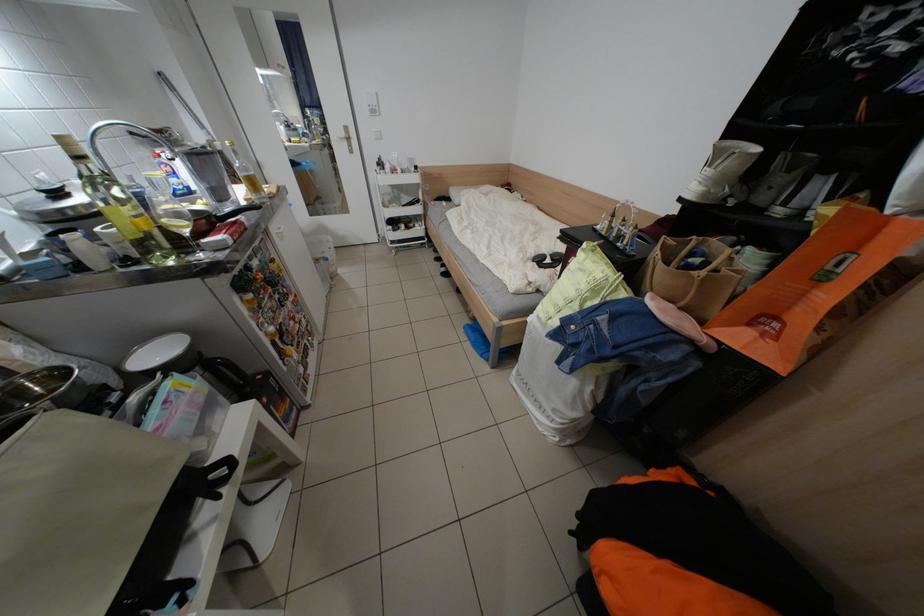
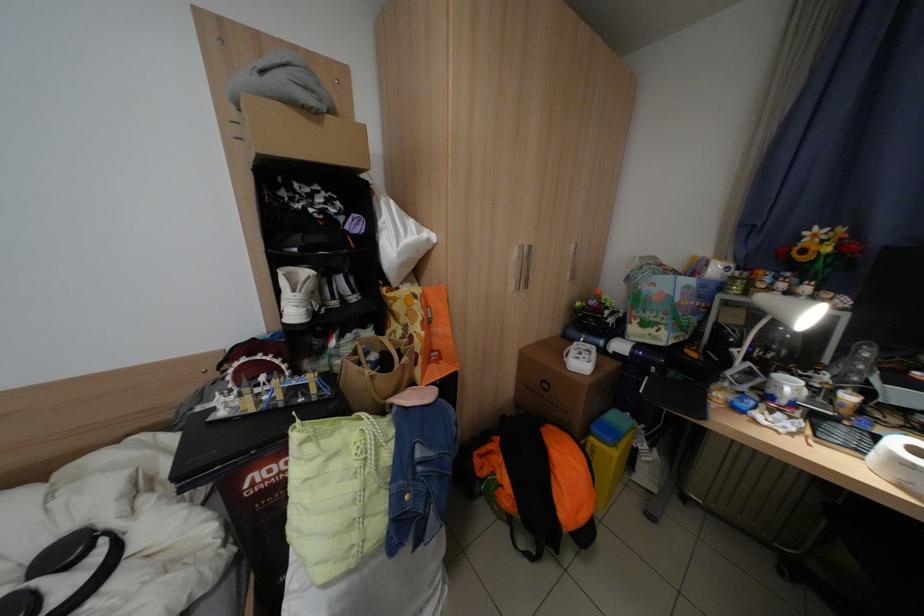
The point at (557, 254) is marked in the first image. Where is the corresponding point in the second image?

(17, 593)